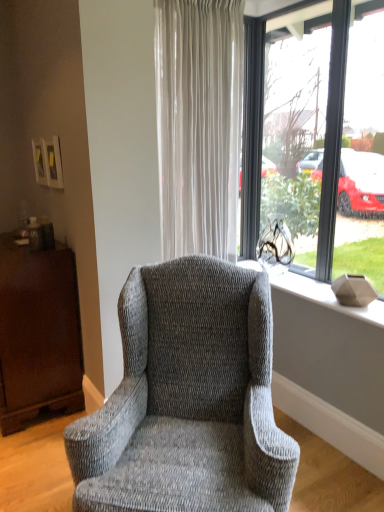
Question: Does mahogany wood dresser at left appear on the left side of matte gray vase at right?

Choices:
 (A) yes
 (B) no

Answer: (A)

Question: Would you consider mahogany wood dresser at left to be distant from matte gray vase at right?

Choices:
 (A) yes
 (B) no

Answer: (A)

Question: From the image's perspective, would you say mahogany wood dresser at left is shown under matte gray vase at right?

Choices:
 (A) no
 (B) yes

Answer: (B)

Question: Is matte gray vase at right surrounded by mahogany wood dresser at left?

Choices:
 (A) yes
 (B) no

Answer: (B)

Question: From the image's perspective, is mahogany wood dresser at left above matte gray vase at right?

Choices:
 (A) yes
 (B) no

Answer: (B)

Question: From a real-world perspective, is transparent glass window at center positioned above or below mahogany wood dresser at left?

Choices:
 (A) below
 (B) above

Answer: (B)

Question: Is transparent glass window at center wider or thinner than mahogany wood dresser at left?

Choices:
 (A) thin
 (B) wide

Answer: (A)

Question: Is transparent glass window at center taller or shorter than mahogany wood dresser at left?

Choices:
 (A) short
 (B) tall

Answer: (B)

Question: In the image, is transparent glass window at center positioned in front of or behind mahogany wood dresser at left?

Choices:
 (A) behind
 (B) front

Answer: (B)

Question: From the image's perspective, is mahogany wood dresser at left located above or below white sheer curtain at center?

Choices:
 (A) above
 (B) below

Answer: (B)

Question: Would you say mahogany wood dresser at left is inside or outside white sheer curtain at center?

Choices:
 (A) inside
 (B) outside

Answer: (B)

Question: Is point (9, 390) positioned closer to the camera than point (218, 216)?

Choices:
 (A) closer
 (B) farther

Answer: (A)

Question: From a real-world perspective, is mahogany wood dresser at left physically located above or below white sheer curtain at center?

Choices:
 (A) below
 (B) above

Answer: (A)

Question: Is textured gray wingback chair at center in front of or behind matte gray vase at right in the image?

Choices:
 (A) behind
 (B) front

Answer: (B)

Question: Is textured gray wingback chair at center to the left or to the right of matte gray vase at right in the image?

Choices:
 (A) right
 (B) left

Answer: (B)